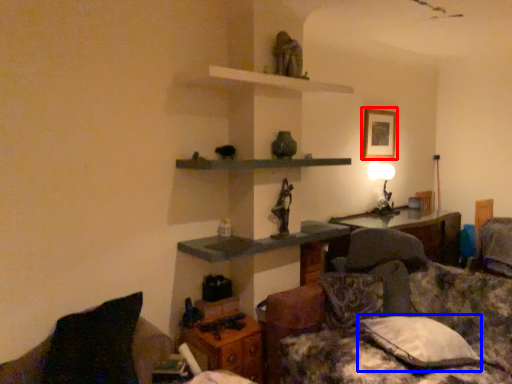
Question: Which object is closer to the camera taking this photo, picture frame (highlighted by a red box) or pillow (highlighted by a blue box)?

Choices:
 (A) picture frame
 (B) pillow

Answer: (B)